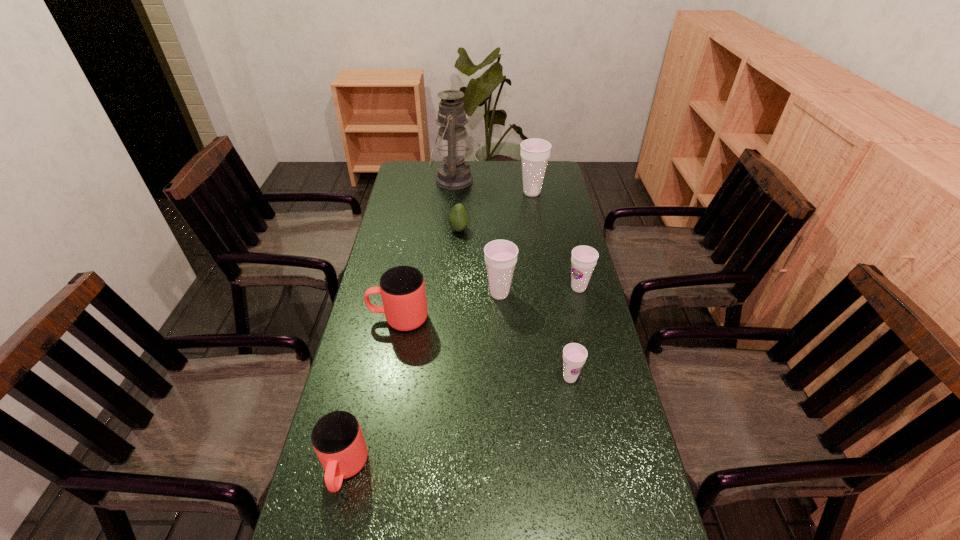
Image resolution: width=960 pixels, height=540 pixels. I want to click on free spot between the farther pink cup and the avocado, so click(428, 274).

This screenshot has width=960, height=540. Find the location of `unoccupied area between the farther pink cup and the biggest purple cup`. unoccupied area between the farther pink cup and the biggest purple cup is located at coordinates (466, 255).

Locate an element on the screen. empty space that is in between the smallest purple cup and the farthest purple cup is located at coordinates (551, 285).

The image size is (960, 540). What are the coordinates of `unoccupied position between the second smallest purple cup and the second tallest object` in the screenshot? It's located at (555, 240).

Where is `free space between the leftmost purple cup and the farther pink cup`? free space between the leftmost purple cup and the farther pink cup is located at coordinates (449, 306).

I want to click on blank region between the smaller pink cup and the bigger pink cup, so click(372, 394).

This screenshot has height=540, width=960. What are the coordinates of `vacant area between the biggest purple cup and the farther pink cup` in the screenshot? It's located at (466, 255).

You are a GUI agent. You are given a task and a screenshot of the screen. Output one action in this format:
    pyautogui.click(x=<x>, y=<y>)
    Task: Click on the free space between the green avocado and the third smallest purple cup
    Image resolution: width=960 pixels, height=540 pixels.
    Given the screenshot: What is the action you would take?
    [479, 261]

Identify which object is the seventh nearest to the farther pink cup. Please provide its 2D coordinates. Your answer should be formatted as a tuple, i.e. [(x, y)], where the tuple contains the x and y coordinates of a point satisfying the conditions above.

[(535, 153)]

The height and width of the screenshot is (540, 960). Identify the location of object that stands as the third closest to the tallest object. (500, 255).